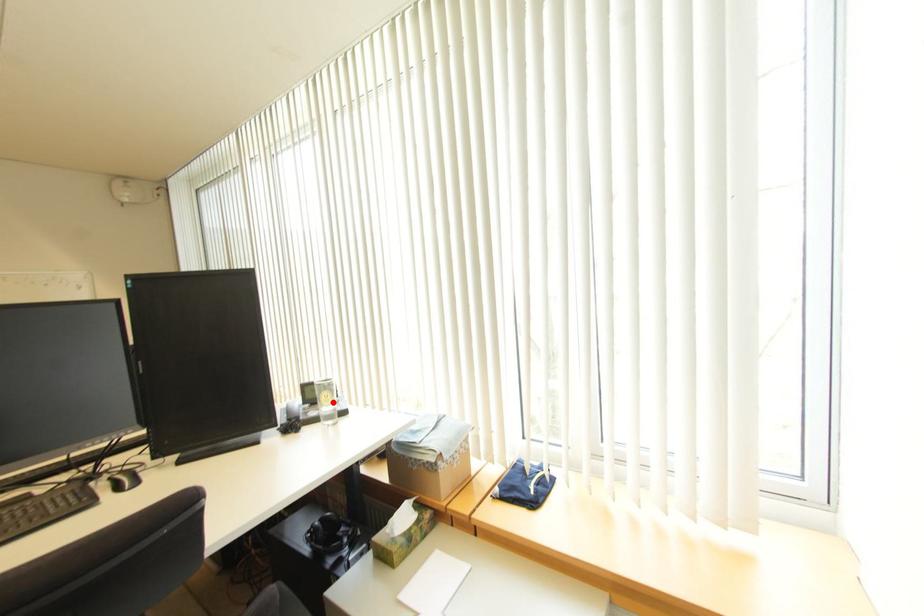
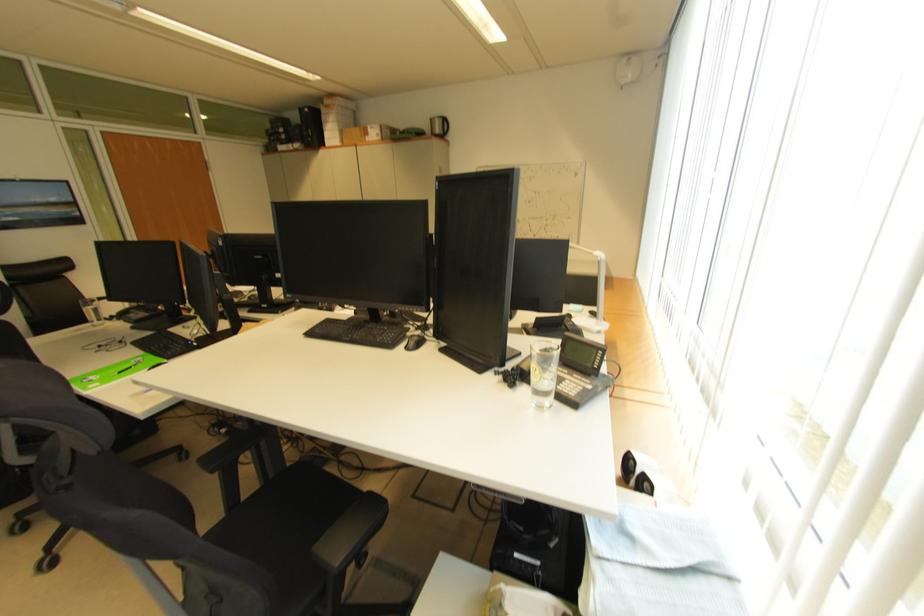
Find the pixel in the second image that matches the highlighted location in the first image.

(541, 379)